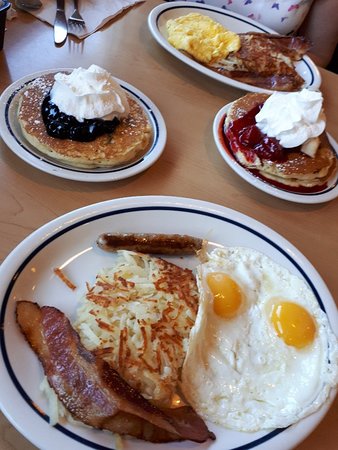
At what (x,y) coordinates should I click in order to perform the action: click on butter knife. Please return your answer as a coordinate pair (x, y). The height and width of the screenshot is (450, 338). Looking at the image, I should click on (56, 34).